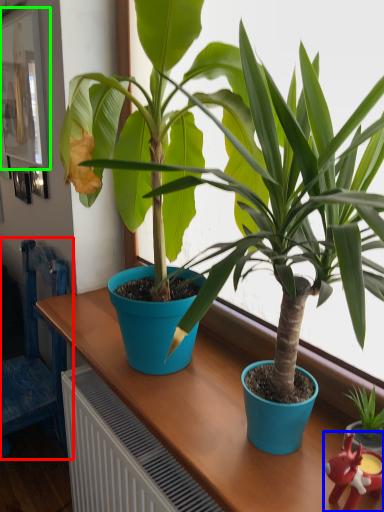
Question: Which object is positioned closest to chair (highlighted by a red box)? Select from toy (highlighted by a blue box) and picture frame (highlighted by a green box).

Choices:
 (A) toy
 (B) picture frame

Answer: (B)